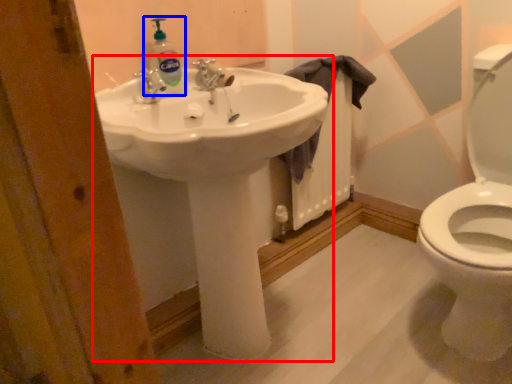
Question: Which of the following is the farthest to the observer, sink (highlighted by a red box) or cleaning product (highlighted by a blue box)?

Choices:
 (A) sink
 (B) cleaning product

Answer: (B)